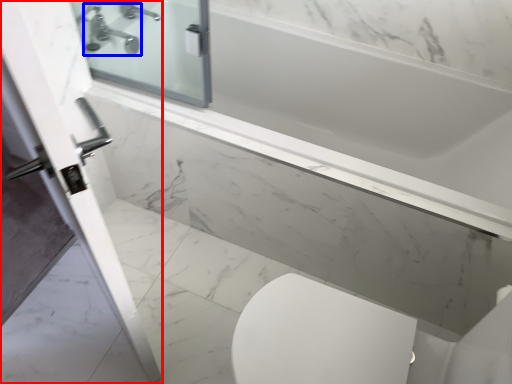
Question: Which object appears closest to the camera in this image, screen door (highlighted by a red box) or tap (highlighted by a blue box)?

Choices:
 (A) screen door
 (B) tap

Answer: (A)